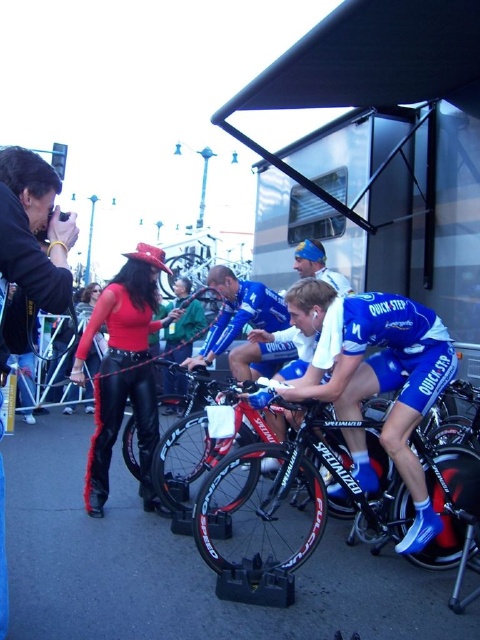
Question: Is blue matte bicycle at center above black leather jacket at left?

Choices:
 (A) yes
 (B) no

Answer: (B)

Question: Among these points, which one is farthest from the camera?

Choices:
 (A) (400, 346)
 (B) (151, 307)

Answer: (B)

Question: Can you confirm if leather pants at center is smaller than blue jersey at center?

Choices:
 (A) yes
 (B) no

Answer: (B)

Question: Which point appears farthest from the camera in this image?

Choices:
 (A) (67, 244)
 (B) (273, 326)
 (C) (116, 406)
 (D) (381, 330)

Answer: (B)

Question: Is blue matte bicycle at center to the right of shiny black bike at center from the viewer's perspective?

Choices:
 (A) no
 (B) yes

Answer: (B)

Question: Which point is closer to the camera?

Choices:
 (A) black leather jacket at left
 (B) blue matte bicycle at center

Answer: (A)